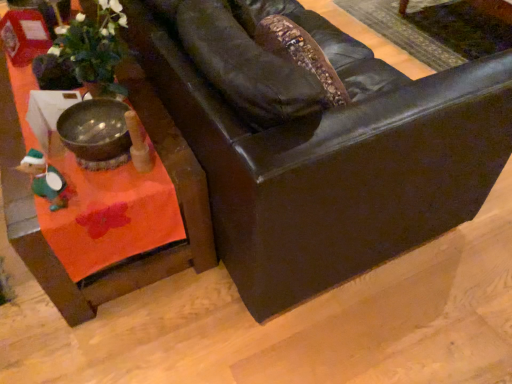
Question: Is orange fabric table at lower left closer to the viewer compared to matte black leather couch at center?

Choices:
 (A) no
 (B) yes

Answer: (A)

Question: From a real-world perspective, is orange fabric table at lower left under matte black leather couch at center?

Choices:
 (A) no
 (B) yes

Answer: (B)

Question: Is orange fabric table at lower left facing away from matte black leather couch at center?

Choices:
 (A) yes
 (B) no

Answer: (A)

Question: From the image's perspective, would you say orange fabric table at lower left is positioned over matte black leather couch at center?

Choices:
 (A) yes
 (B) no

Answer: (B)

Question: From a real-world perspective, is orange fabric table at lower left positioned over matte black leather couch at center based on gravity?

Choices:
 (A) no
 (B) yes

Answer: (A)

Question: Is orange fabric table at lower left bigger than matte black leather couch at center?

Choices:
 (A) yes
 (B) no

Answer: (B)

Question: Can you confirm if green felt toy at lower left is smaller than matte black leather couch at center?

Choices:
 (A) yes
 (B) no

Answer: (A)

Question: From the image's perspective, is green felt toy at lower left on top of matte black leather couch at center?

Choices:
 (A) yes
 (B) no

Answer: (B)

Question: Is matte black leather couch at center at the back of green felt toy at lower left?

Choices:
 (A) yes
 (B) no

Answer: (A)

Question: Considering the relative positions of green felt toy at lower left and matte black leather couch at center in the image provided, is green felt toy at lower left in front of matte black leather couch at center?

Choices:
 (A) no
 (B) yes

Answer: (A)

Question: Is green felt toy at lower left to the left of matte black leather couch at center from the viewer's perspective?

Choices:
 (A) yes
 (B) no

Answer: (A)

Question: Are green felt toy at lower left and matte black leather couch at center making contact?

Choices:
 (A) no
 (B) yes

Answer: (A)

Question: From the image's perspective, would you say orange fabric table at lower left is shown under green felt toy at lower left?

Choices:
 (A) yes
 (B) no

Answer: (B)